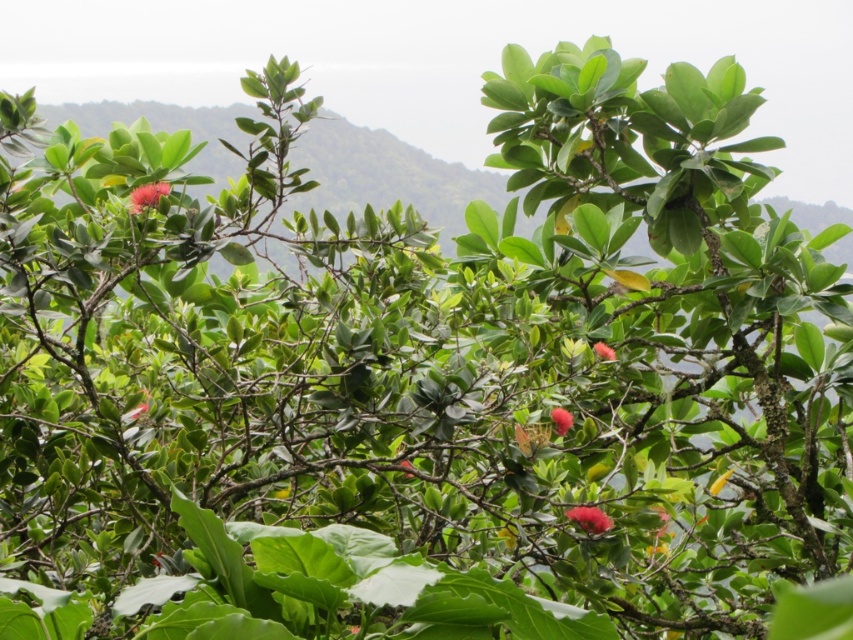
Question: Does vivid pink flower at center have a greater width compared to smooth red flower at center?

Choices:
 (A) yes
 (B) no

Answer: (A)

Question: Is red matte flower at center-right smaller than smooth pink flower at center?

Choices:
 (A) no
 (B) yes

Answer: (A)

Question: Among these points, which one is nearest to the camera?

Choices:
 (A) (161, 184)
 (B) (560, 435)
 (C) (589, 529)

Answer: (C)

Question: Which of these objects is positioned closest to the smooth red flower at center?

Choices:
 (A) smooth pink flower at center
 (B) red matte flower at center-right

Answer: (A)

Question: Which object is the closest to the smooth pink flower at center?

Choices:
 (A) glossy red flower at upper left
 (B) smooth red flower at center
 (C) vivid pink flower at center

Answer: (B)

Question: Can you confirm if glossy red flower at upper left is thinner than red matte flower at center-right?

Choices:
 (A) yes
 (B) no

Answer: (B)